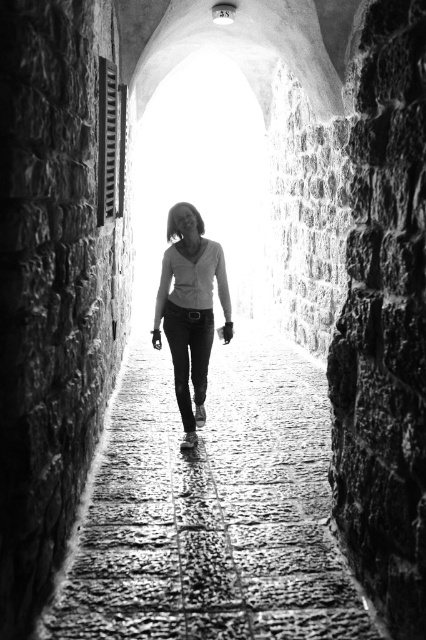
Who is higher up, smooth stone path at center or matte white blouse at center?

matte white blouse at center is above.

Is smooth stone path at center shorter than matte white blouse at center?

Yes, smooth stone path at center is shorter than matte white blouse at center.

This screenshot has width=426, height=640. In order to click on smooth stone path at center in this screenshot , I will do click(x=212, y=509).